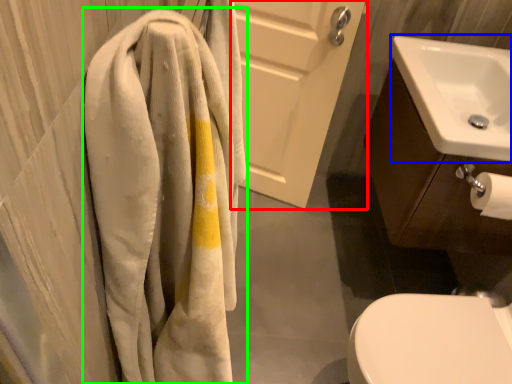
Question: Which object is positioned farthest from screen door (highlighted by a red box)? Select from sink (highlighted by a blue box) and towel (highlighted by a green box).

Choices:
 (A) sink
 (B) towel

Answer: (B)